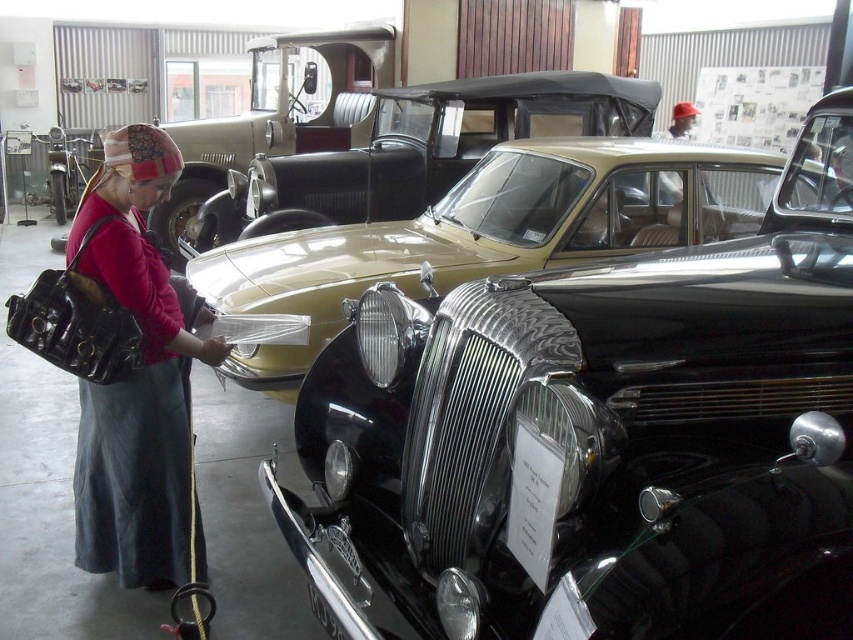
Does point (640, 202) come behind point (387, 154)?

No, it is in front of (387, 154).

Measure the distance between point (631, 195) and camera.

Point (631, 195) and camera are 4.25 meters apart.

In order to click on metallic gold car at center in this screenshot , I will do `click(486, 234)`.

Which is more to the right, black polished metal car at center or matte black purse at left?

Positioned to the right is black polished metal car at center.

Is black polished metal car at center taller than matte black purse at left?

Yes, black polished metal car at center is taller than matte black purse at left.

I want to click on black polished metal car at center, so click(599, 440).

Does point (619, 563) lie in front of point (283, 244)?

Yes, it is in front of point (283, 244).

Is black polished metal car at center taller than metallic gold car at center?

Yes.

This screenshot has height=640, width=853. Find the location of `black polished metal car at center`. black polished metal car at center is located at coordinates (x=599, y=440).

At what (x,y) coordinates should I click in order to perform the action: click on black polished metal car at center. Please return your answer as a coordinate pair (x, y). Looking at the image, I should click on (599, 440).